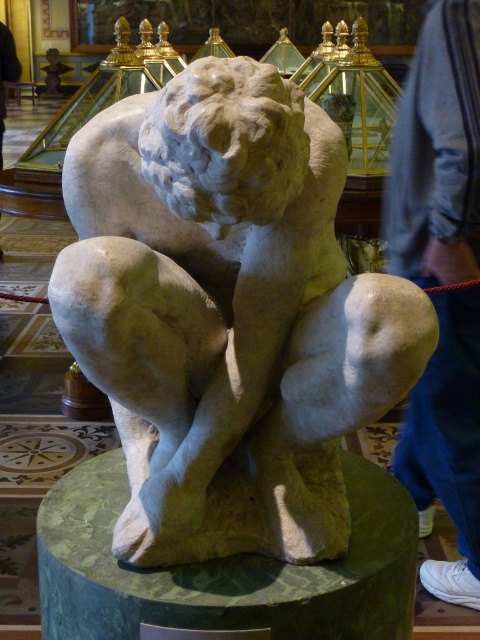
Question: Is white marble lion at center wider than green marble pedestal at center?

Choices:
 (A) yes
 (B) no

Answer: (B)

Question: Is green marble pedestal at center positioned at the back of blue jeans at lower right?

Choices:
 (A) no
 (B) yes

Answer: (A)

Question: Can you confirm if white marble lion at center is positioned to the left of blue jeans at lower right?

Choices:
 (A) no
 (B) yes

Answer: (B)

Question: Which of the following is the closest to the observer?

Choices:
 (A) (474, 196)
 (B) (331, 170)
 (C) (92, 493)

Answer: (B)

Question: Which point is farther to the camera?

Choices:
 (A) white marble lion at center
 (B) green marble pedestal at center
 (C) blue jeans at lower right

Answer: (C)

Question: Among these objects, which one is farthest from the camera?

Choices:
 (A) blue jeans at lower right
 (B) white marble lion at center
 (C) green marble pedestal at center

Answer: (A)